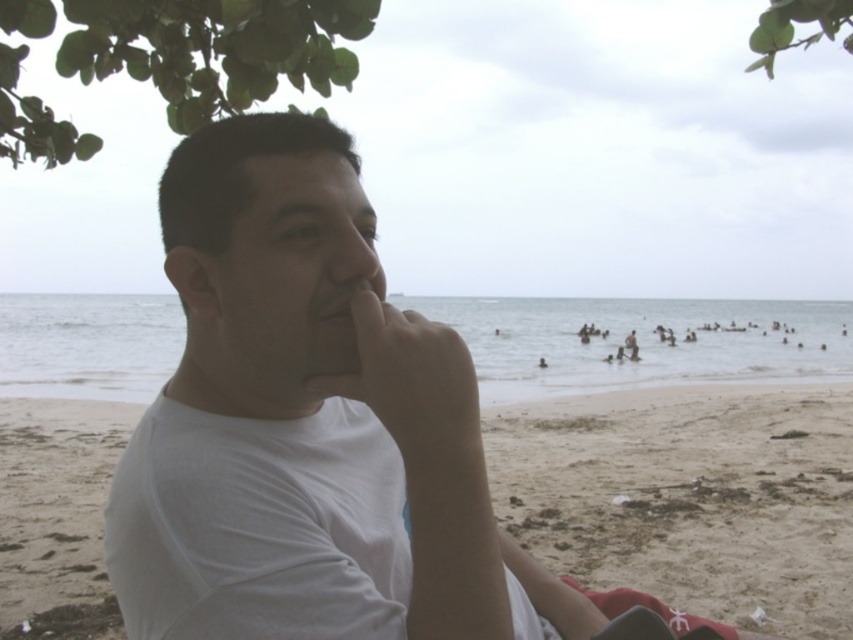
Consider the image. Does green leafy tree at upper left have a larger size compared to green leafy tree at upper right?

Actually, green leafy tree at upper left might be smaller than green leafy tree at upper right.

Who is lower down, green leafy tree at upper left or green leafy tree at upper right?

green leafy tree at upper left

Does point (192, 33) come behind point (840, 13)?

Yes, point (192, 33) is farther from viewer.

Where is `green leafy tree at upper left`? This screenshot has height=640, width=853. green leafy tree at upper left is located at coordinates (213, 49).

Which of these two, white matte t-shirt at center or green leafy tree at upper left, stands shorter?

green leafy tree at upper left

Between white matte t-shirt at center and green leafy tree at upper left, which one has more height?

white matte t-shirt at center is taller.

In order to click on white matte t-shirt at center in this screenshot , I will do `click(300, 420)`.

Between point (612, 541) and point (851, 24), which one is positioned behind?

Positioned behind is point (612, 541).

Is point (19, 579) positioned before point (817, 10)?

No, it is behind (817, 10).

Image resolution: width=853 pixels, height=640 pixels. I want to click on white fabric at center, so click(x=689, y=497).